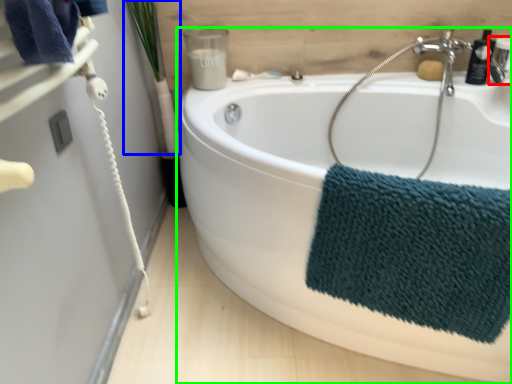
Question: Estimate the real-world distances between objects in this image. Which object is farther from plumbing fixture (highlighted by a red box), plant (highlighted by a blue box) or bathtub (highlighted by a green box)?

Choices:
 (A) plant
 (B) bathtub

Answer: (A)